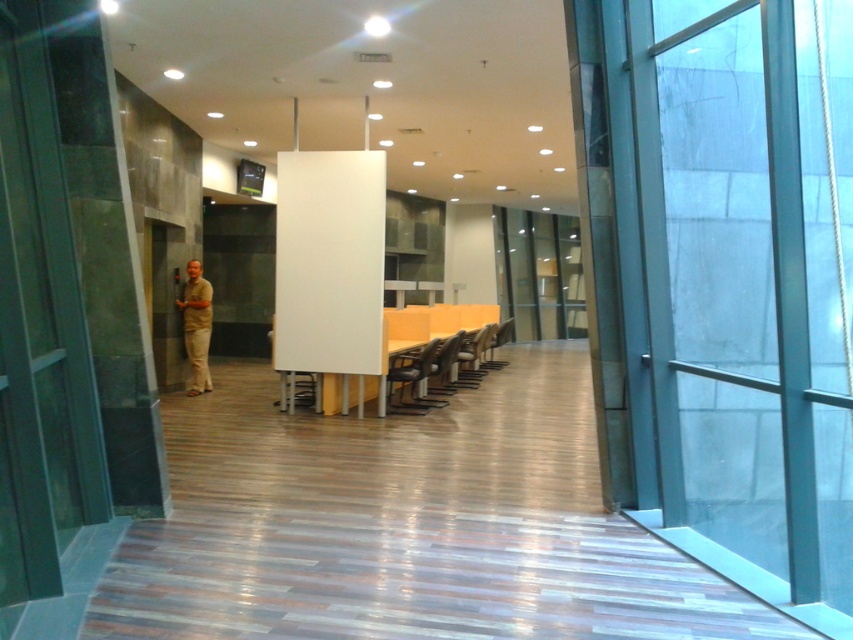
Question: Is white glossy table at center closer to the viewer compared to matte plastic chair at center?

Choices:
 (A) no
 (B) yes

Answer: (B)

Question: Which of the following is the farthest from the observer?

Choices:
 (A) matte black chair at center
 (B) beige fabric pants at left

Answer: (A)

Question: Estimate the real-world distances between objects in this image. Which object is closer to the transparent glass door at right?

Choices:
 (A) matte black chair at center
 (B) white glossy table at center
 (C) beige fabric pants at left

Answer: (B)

Question: Which object appears closest to the camera in this image?

Choices:
 (A) matte plastic chair at center
 (B) metallic silver chair at center
 (C) matte gray chair at center

Answer: (B)

Question: Does transparent glass door at right have a larger size compared to matte plastic chair at center?

Choices:
 (A) no
 (B) yes

Answer: (B)

Question: Is transparent glass door at right positioned at the back of metallic silver chair at center?

Choices:
 (A) yes
 (B) no

Answer: (B)